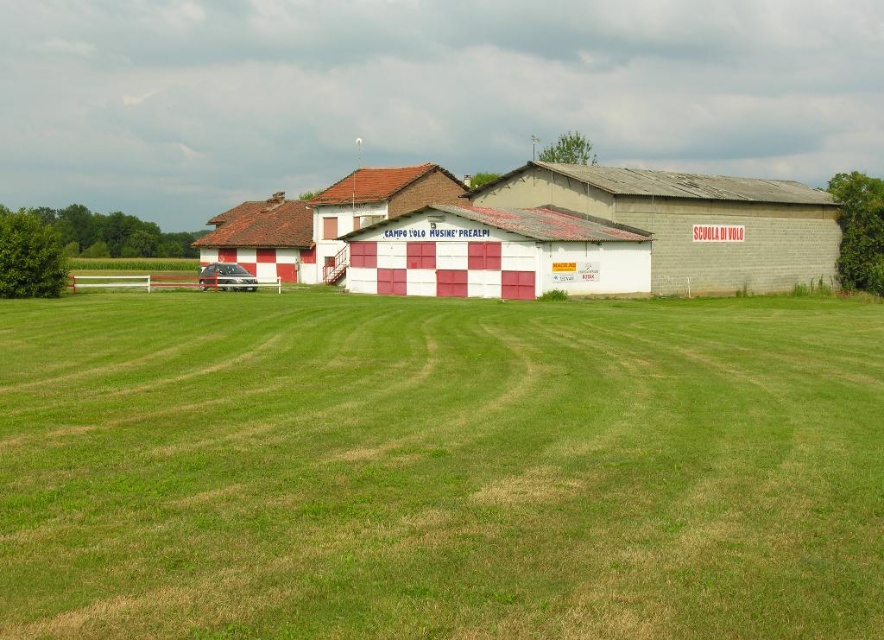
You are a drone operator planning to land a drone in the field. The drone requires a landing area that is larger than the green grass at center. Can the checkerboard painted barn at center provide a suitable landing spot? Please explain.

The green grass at center is smaller than the checkerboard painted barn at center. However, the checkerboard painted barn at center is a structure and not a flat area, so it cannot be used as a landing spot for the drone. The drone needs a flat open space like the green grass at center, but since the grass area is smaller than required, there might not be a suitable landing spot available.

Consider the image. You are a drone operator preparing to land a drone in the field. The green grass at center and the metallic silver car at center are both visible from your vantage point. Which object is closer to the ground?

The green grass at center is below the metallic silver car at center, so the green grass at center is closer to the ground.

You are a photographer planning to capture a wide shot of the checkerboard painted barn at center and the metallic silver car at center. Given their sizes, which object should you position closer to the camera to ensure both appear roughly the same size in the final photo?

Since the checkerboard painted barn at center is larger than the metallic silver car at center, you should position the metallic silver car at center closer to the camera. This way, the smaller car will appear larger in the frame, balancing its size with the barn in the photograph.